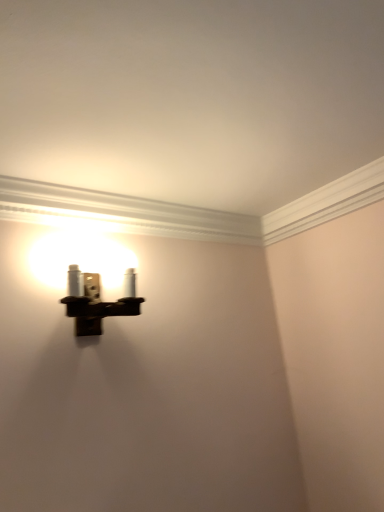
The image size is (384, 512). I want to click on matte black sconce at upper left, so click(x=87, y=278).

What do you see at coordinates (87, 278) in the screenshot?
I see `matte black sconce at upper left` at bounding box center [87, 278].

In order to face matte black sconce at upper left, should I rotate leftwards or rightwards?

You should look left and rotate roughly 12.883 degrees.

Measure the distance between point (53,248) and camera.

1.30 meters.

Identify the location of matte black sconce at upper left. The height and width of the screenshot is (512, 384). (87, 278).